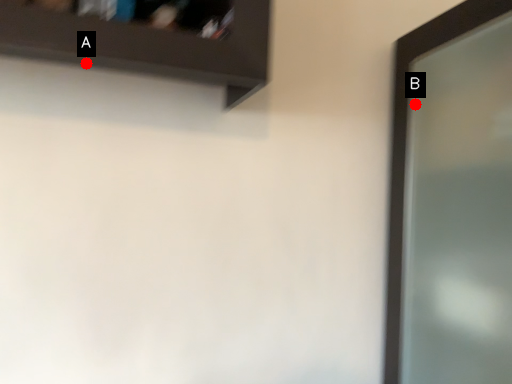
Question: Two points are circled on the image, labeled by A and B beside each circle. Among these points, which one is farthest from the camera?

Choices:
 (A) A is further
 (B) B is further

Answer: (B)